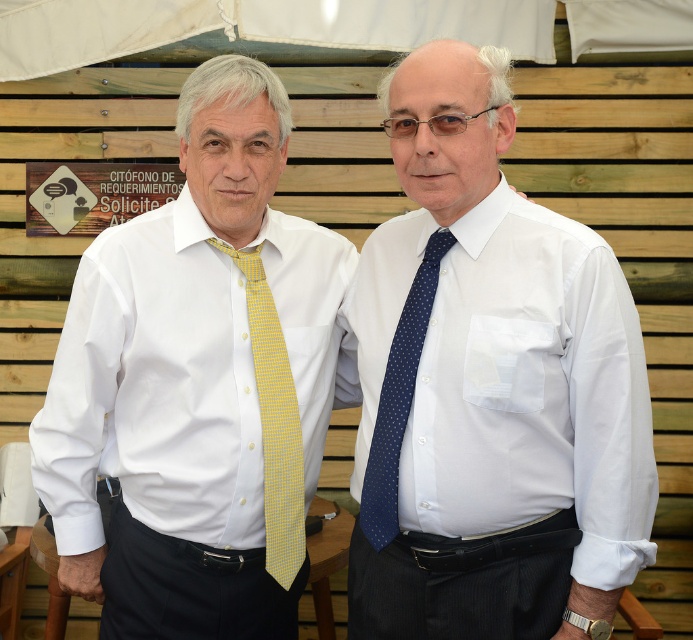
Which is below, white smooth shirt at left or blue dotted tie at center?

Positioned lower is white smooth shirt at left.

Is white smooth shirt at left to the right of blue dotted tie at center from the viewer's perspective?

In fact, white smooth shirt at left is to the left of blue dotted tie at center.

Between point (313, 316) and point (394, 339), which one is positioned in front?

Point (394, 339) is in front.

What are the coordinates of `white smooth shirt at left` in the screenshot? It's located at (155, 388).

Is white smooth shirt at center to the left of blue dotted tie at center from the viewer's perspective?

In fact, white smooth shirt at center is to the right of blue dotted tie at center.

Is point (374, 234) positioned behind point (421, 346)?

Yes.

Where is `white smooth shirt at center`? This screenshot has width=693, height=640. white smooth shirt at center is located at coordinates (532, 392).

Does white smooth shirt at center have a smaller size compared to yellow dotted tie at center?

No.

Is white smooth shirt at center positioned in front of yellow dotted tie at center?

Yes.

Where is `white smooth shirt at center`? Image resolution: width=693 pixels, height=640 pixels. white smooth shirt at center is located at coordinates 532,392.